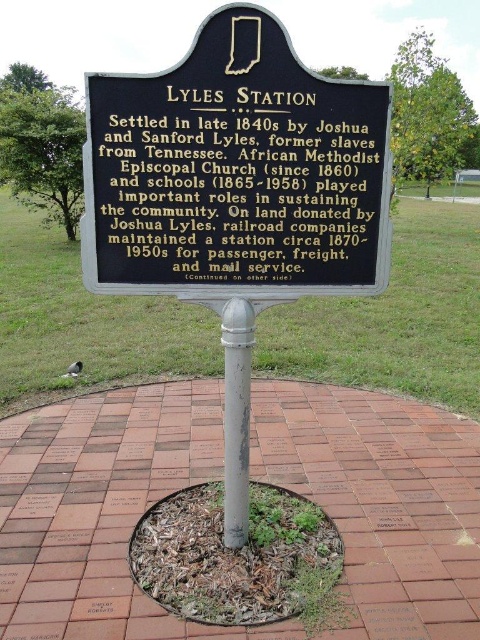
Question: Which point is closer to the camera?

Choices:
 (A) black metal sign at center
 (B) silver metallic pole at center

Answer: (A)

Question: Can you confirm if black metal sign at center is thinner than silver metallic pole at center?

Choices:
 (A) no
 (B) yes

Answer: (A)

Question: Is black metal sign at center further to the viewer compared to silver metallic pole at center?

Choices:
 (A) yes
 (B) no

Answer: (B)

Question: Which of the following is the farthest from the observer?

Choices:
 (A) silver metallic pole at center
 (B) black metal sign at center

Answer: (A)

Question: Does black metal sign at center have a smaller size compared to silver metallic pole at center?

Choices:
 (A) yes
 (B) no

Answer: (B)

Question: Which of the following is the farthest from the observer?

Choices:
 (A) (122, 102)
 (B) (225, 541)

Answer: (B)